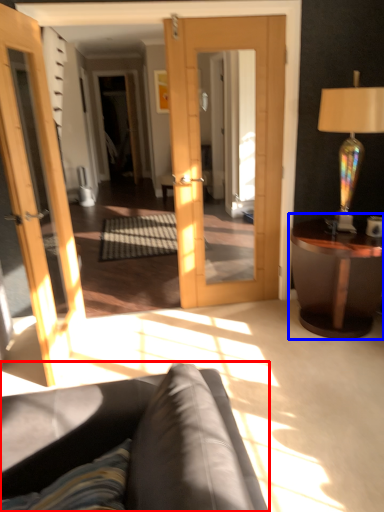
Question: Which object is closer to the camera taking this photo, studio couch (highlighted by a red box) or table (highlighted by a blue box)?

Choices:
 (A) studio couch
 (B) table

Answer: (A)